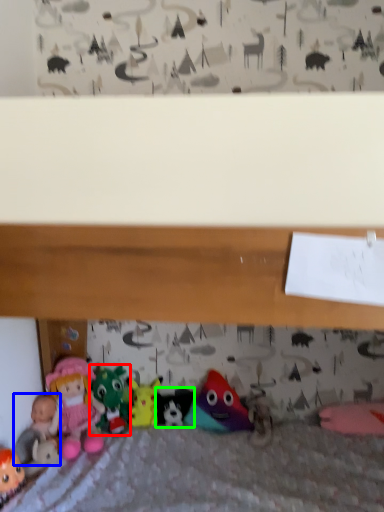
Question: Estimate the real-world distances between objects in this image. Which object is closer to toy (highlighted by a red box), toy (highlighted by a blue box) or toy (highlighted by a green box)?

Choices:
 (A) toy
 (B) toy

Answer: (B)